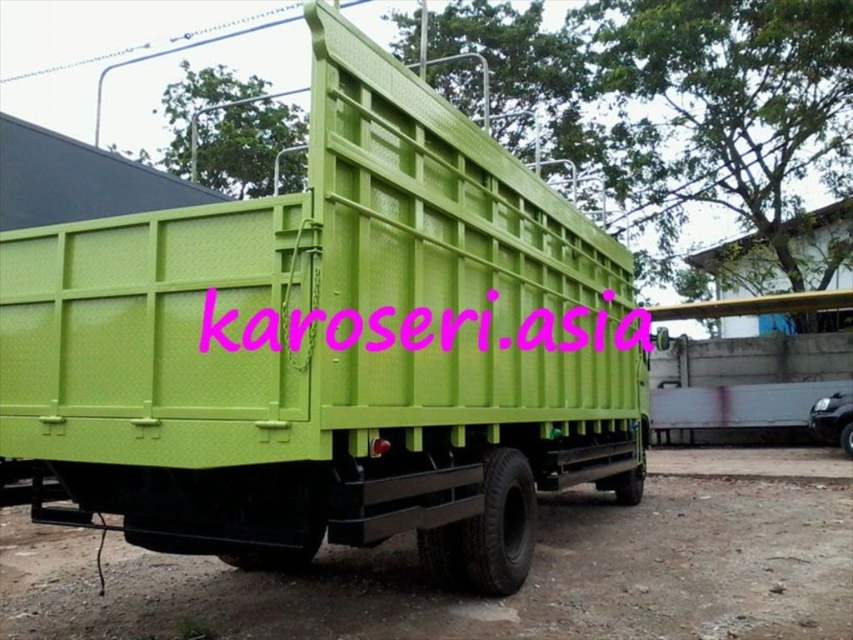
You see a lime green plastic truck at center and a pink text at center in the image. Which object is positioned to the left?

The lime green plastic truck at center is positioned to the left of the pink text at center.

You are a delivery person who needs to place a box on the truck. The box is exactly the same width as the pink text at center. Can you fit the box on the lime green plastic truck at center without it hanging over the edges?

The lime green plastic truck at center is wider than the pink text at center. Since the box matches the pink text at center in width, it will fit on the lime green plastic truck at center without overhanging.